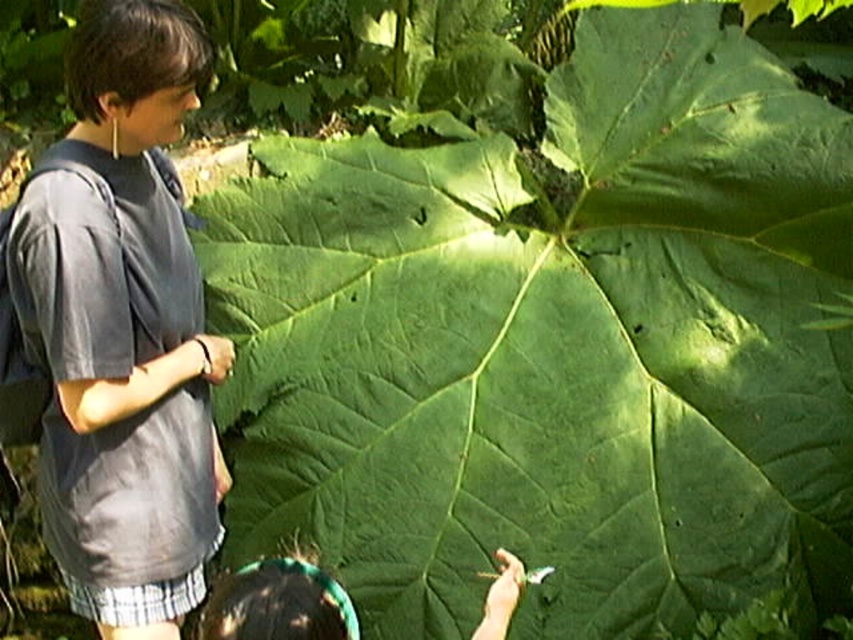
You are standing in front of the plant and want to reach both points mentioned. Which point is closer to you, point (68, 221) or point (323, 636)?

Point (68, 221) is closer to you because it is further to the viewer than point (323, 636).

You are a photographer trying to capture the dark green leaf at lower center without the gray cotton shirt at left blocking it. Can you adjust your position to do so?

The gray cotton shirt at left is positioned over the dark green leaf at lower center, so moving your camera position slightly to the side or lower might allow you to frame the leaf without the shirt blocking it.

You are a hiker who needs to reach the gray cotton shirt at left. The distance between you and the shirt is 6.26 feet. Can you comfortably reach it without moving your feet?

The distance between you and the gray cotton shirt at left is 6.26 feet, which is beyond typical comfortable reaching distance for most people. You would need to move closer or take a step forward to comfortably reach it.